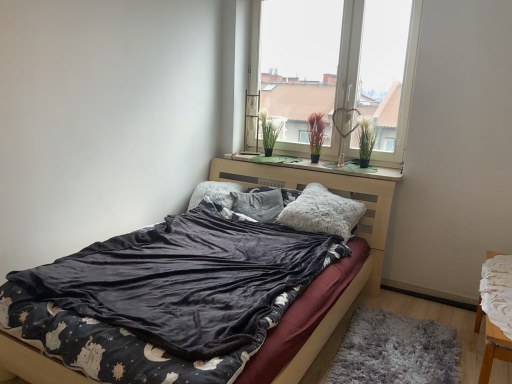
Question: Do you think transparent glass window at upper center is within green felt at center, or outside of it?

Choices:
 (A) inside
 (B) outside

Answer: (B)

Question: Is point click(x=325, y=135) positioned closer to the camera than point click(x=256, y=157)?

Choices:
 (A) closer
 (B) farther

Answer: (A)

Question: Which is nearer to the green felt at center?

Choices:
 (A) green matte plant at center, the 3th plant positioned from the right
 (B) gray shaggy rug at lower right
 (C) green matte plant at upper right, which appears as the 3th plant when viewed from the left
 (D) fluffy gray pillow at center, placed as the third pillow when sorted from left to right
 (E) white lace chair at lower right

Answer: (C)

Question: Estimate the real-world distances between objects in this image. Which object is closer to the burgundy matte plant at center, placed as the second plant when sorted from left to right?

Choices:
 (A) green matte plant at center, the 3th plant positioned from the right
 (B) white lace chair at lower right
 (C) gray shaggy rug at lower right
 (D) transparent glass window at upper center
 (E) fluffy gray pillow at center, the 1th pillow viewed from the right

Answer: (A)